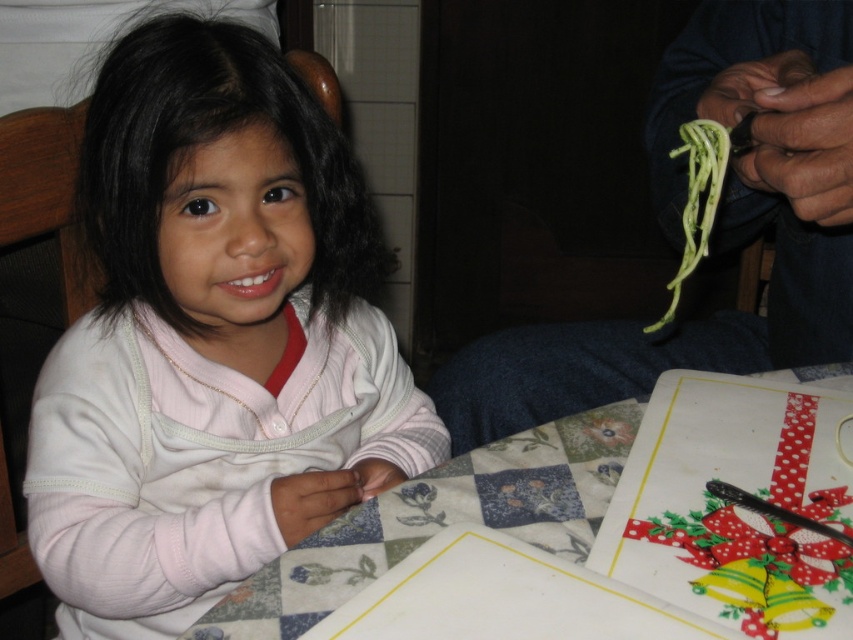
You are helping to set up a holiday table and have both the pink fleece sweater at center and the white fabric table at center. Which item takes up less horizontal space?

The pink fleece sweater at center has a lesser width compared to the white fabric table at center, so it takes up less horizontal space.

Looking at this image, you are organizing a winter photoshoot and need to ensure the pink fleece sweater at center is visible in the frame. Given its coordinates at point 0.533, 0.249, can you confirm if it is centrally positioned within the image?

The pink fleece sweater at center is located at point (212, 340), which is close to the center coordinates of an image typically at (426, 320). Therefore, it is centrally positioned within the image.

You are setting up a small dining area for a holiday gathering. You have a white fabric table at center and a green matte spaghetti at upper right. Which object has a greater width?

The white fabric table at center has a greater width than the green matte spaghetti at upper right.